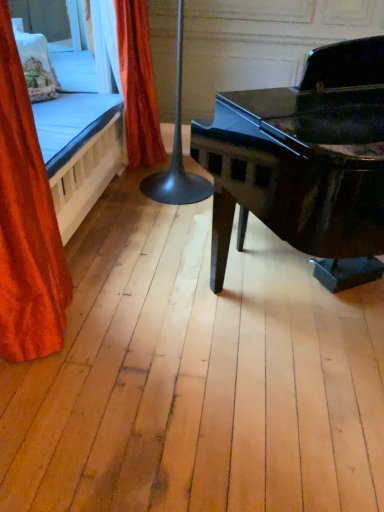
At what (x,y) coordinates should I click in order to perform the action: click on free location to the right of orange velvet curtain at left, marked as the 1th curtain in a front-to-back arrangement. Please return your answer as a coordinate pair (x, y). The width and height of the screenshot is (384, 512). Looking at the image, I should click on (120, 328).